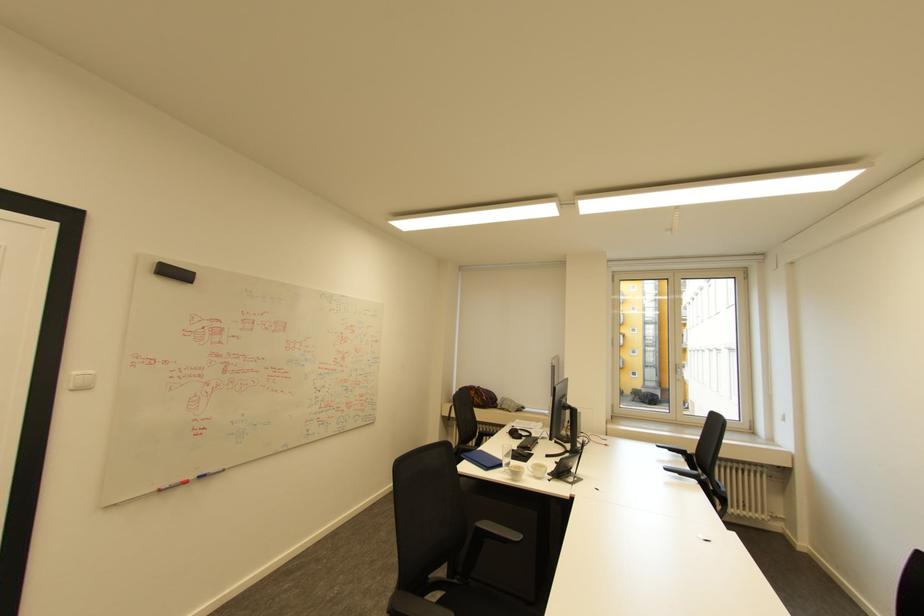
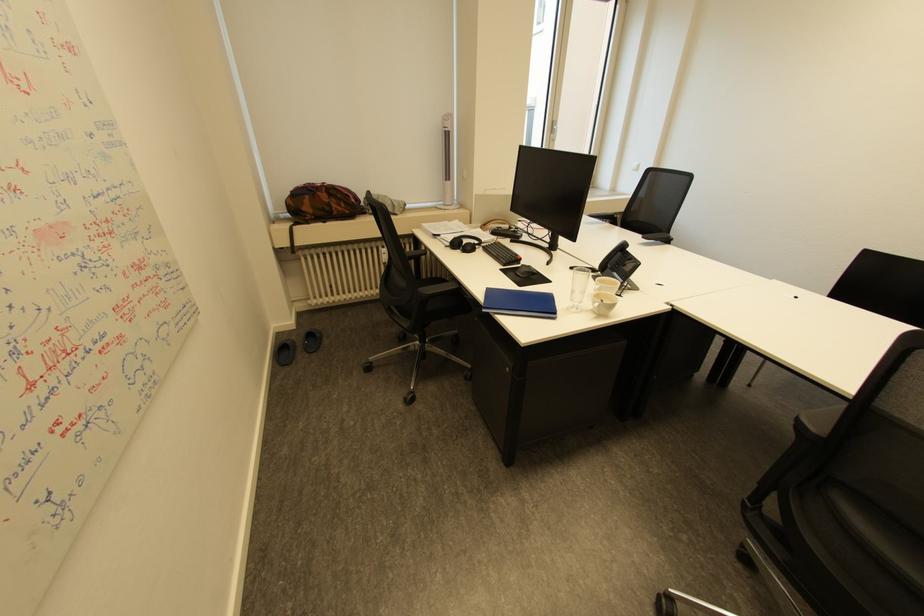
Locate, in the second image, the point that corresponds to (541,435) in the first image.

(490, 240)